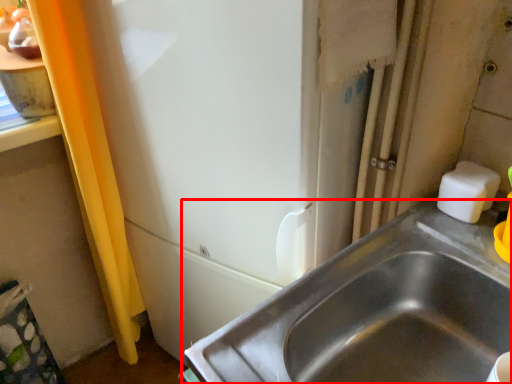
Question: From the image, what is the correct spatial relationship of sink (annotated by the red box) in relation to soap?

Choices:
 (A) left
 (B) right

Answer: (A)